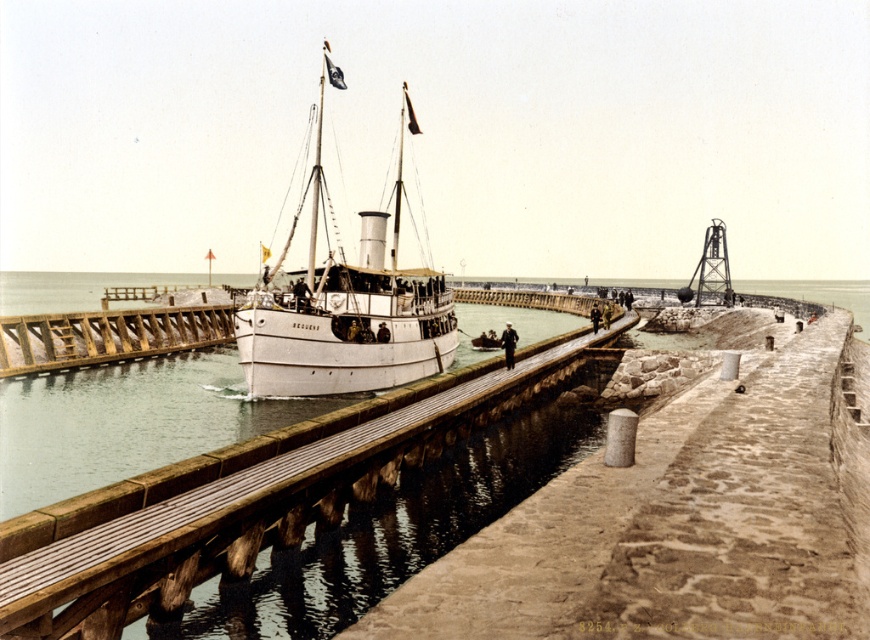
Between point (407, 301) and point (54, 365), which one is positioned behind?

The point (407, 301) is behind.

I want to click on white matte ship at center, so click(348, 308).

What are the coordinates of `white matte ship at center` in the screenshot? It's located at pos(348,308).

In order to click on white matte ship at center in this screenshot , I will do `click(348, 308)`.

Looking at this image, can you confirm if wooden at center is smaller than wooden at left?

Actually, wooden at center might be larger than wooden at left.

The width and height of the screenshot is (870, 640). Describe the element at coordinates (251, 497) in the screenshot. I see `wooden at center` at that location.

At what (x,y) coordinates should I click in order to perform the action: click on wooden at center. Please return your answer as a coordinate pair (x, y). Looking at the image, I should click on (251, 497).

Can you confirm if wooden at center is bigger than white matte ship at center?

No, wooden at center is not bigger than white matte ship at center.

From the picture: Does wooden at center appear on the left side of white matte ship at center?

Incorrect, wooden at center is not on the left side of white matte ship at center.

Is point (25, 605) positioned before point (373, 246)?

Yes.

At what (x,y) coordinates should I click in order to perform the action: click on wooden at center. Please return your answer as a coordinate pair (x, y). This screenshot has height=640, width=870. Looking at the image, I should click on (251, 497).